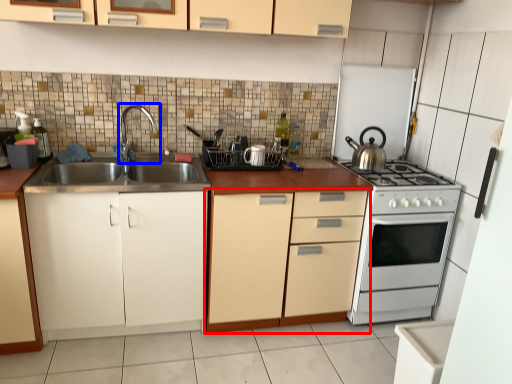
Question: Among these objects, which one is farthest to the camera, cabinetry (highlighted by a red box) or tap (highlighted by a blue box)?

Choices:
 (A) cabinetry
 (B) tap

Answer: (B)